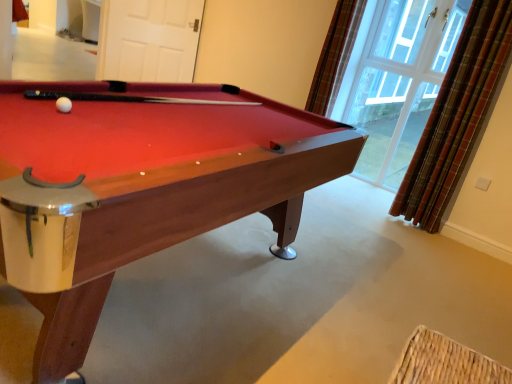
Question: Considering the relative positions of plaid fabric curtain at upper right, which ranks as the first curtain in left-to-right order, and wooden billiard table at center in the image provided, is plaid fabric curtain at upper right, which ranks as the first curtain in left-to-right order, to the left of wooden billiard table at center from the viewer's perspective?

Choices:
 (A) yes
 (B) no

Answer: (B)

Question: Would you say plaid fabric curtain at upper right, which ranks as the first curtain in left-to-right order, is outside wooden billiard table at center?

Choices:
 (A) yes
 (B) no

Answer: (A)

Question: Is plaid fabric curtain at upper right, which ranks as the first curtain in left-to-right order, to the right of wooden billiard table at center from the viewer's perspective?

Choices:
 (A) no
 (B) yes

Answer: (B)

Question: Is plaid fabric curtain at upper right, which ranks as the first curtain in left-to-right order, wider than wooden billiard table at center?

Choices:
 (A) yes
 (B) no

Answer: (B)

Question: Based on their sizes in the image, would you say white matte door at upper center is bigger or smaller than plaid fabric curtain at upper right, which ranks as the first curtain in left-to-right order?

Choices:
 (A) small
 (B) big

Answer: (B)

Question: From the image's perspective, is white matte door at upper center located above or below plaid fabric curtain at upper right, which ranks as the first curtain in left-to-right order?

Choices:
 (A) above
 (B) below

Answer: (A)

Question: Visually, is white matte door at upper center positioned to the left or to the right of plaid fabric curtain at upper right, which ranks as the first curtain in left-to-right order?

Choices:
 (A) left
 (B) right

Answer: (A)

Question: Is white matte door at upper center in front of or behind plaid fabric curtain at upper right, which ranks as the first curtain in left-to-right order, in the image?

Choices:
 (A) behind
 (B) front

Answer: (A)

Question: In terms of size, does wooden billiard table at center appear bigger or smaller than clear glass window at upper right?

Choices:
 (A) small
 (B) big

Answer: (B)

Question: From the image's perspective, is wooden billiard table at center positioned above or below clear glass window at upper right?

Choices:
 (A) below
 (B) above

Answer: (A)

Question: In terms of width, does wooden billiard table at center look wider or thinner when compared to clear glass window at upper right?

Choices:
 (A) thin
 (B) wide

Answer: (B)

Question: From a real-world perspective, relative to clear glass window at upper right, is wooden billiard table at center vertically above or below?

Choices:
 (A) below
 (B) above

Answer: (A)

Question: Would you say plaid fabric curtain at upper right, which ranks as the first curtain in left-to-right order, is inside or outside white matte door at upper center?

Choices:
 (A) inside
 (B) outside

Answer: (B)

Question: From the image's perspective, is plaid fabric curtain at upper right, which is the 2th curtain in right-to-left order, positioned above or below white matte door at upper center?

Choices:
 (A) below
 (B) above

Answer: (A)